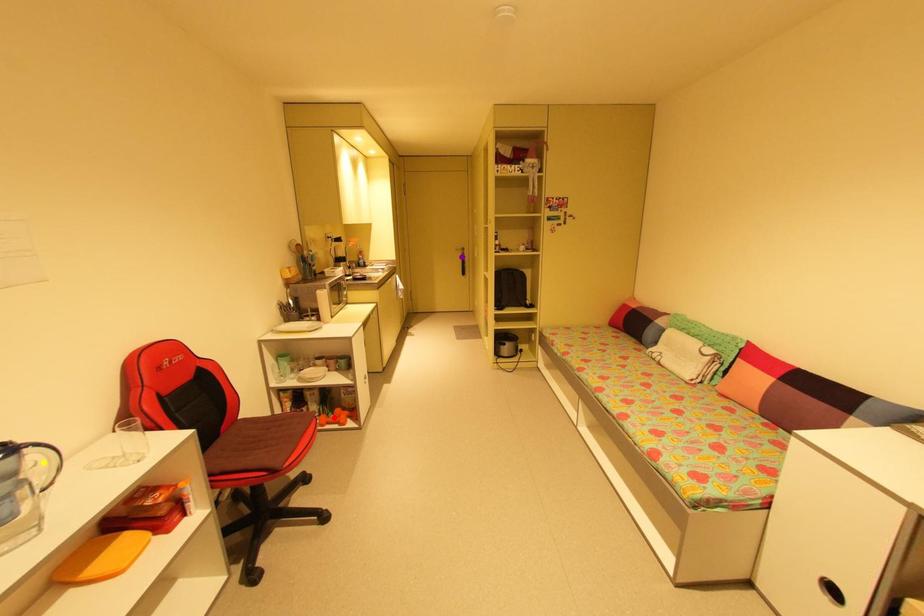
Order these from nearest to farthest:
red point, purple point, yellow point

yellow point → red point → purple point